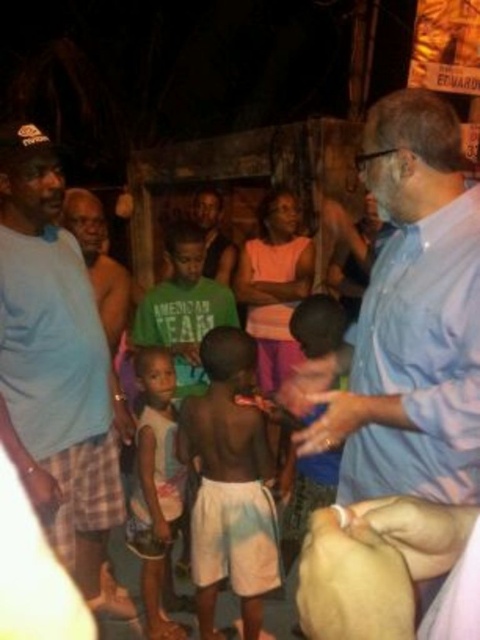
You are at a nighttime gathering and want to locate the person wearing a light blue shirt at upper right. From the person with light skin smooth skin at center, in which direction should you look?

You should look to the right of light skin smooth skin at center to find the light blue shirt at upper right.